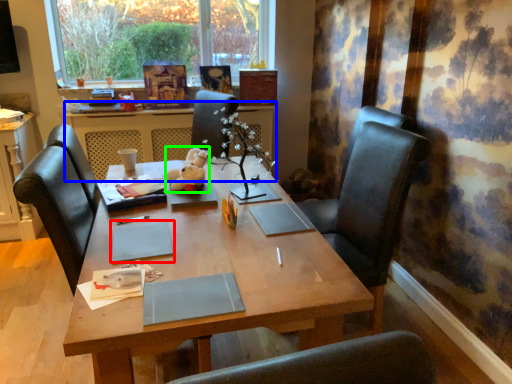
Question: Based on their relative distances, which object is nearer to notebook (highlighted by a red box)? Choose from table (highlighted by a blue box) and toy (highlighted by a green box).

Choices:
 (A) table
 (B) toy

Answer: (B)